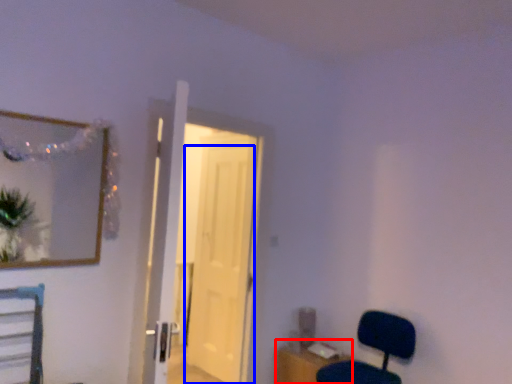
Question: Which point is further to the camera, table (highlighted by a red box) or door (highlighted by a blue box)?

Choices:
 (A) table
 (B) door

Answer: (B)